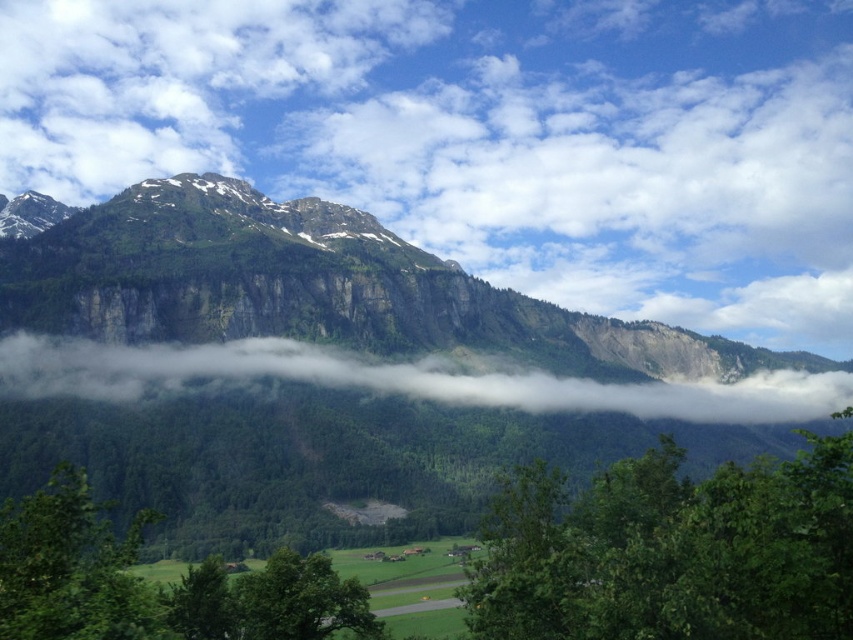
You are standing in the valley and want to take a photo of the green leafy tree at lower center and the green rocky mountain range at upper center. Which object will appear closer to you in the photo?

The green leafy tree at lower center will appear closer to you in the photo because it is positioned behind the green rocky mountain range at upper center, meaning the tree is farther away from the camera than the mountain range.

You are standing in the valley and looking towards the mountains. There is a point at coordinates [397,380] which marks a specific location in the scene. What is located at that point?

The point at coordinates [397,380] indicates the location of white fluffy fog at center.

You are an explorer trying to navigate through the valley. You see the green rocky mountain range at upper center and the white fluffy fog at center. Which object is positioned to the left of the other?

The green rocky mountain range at upper center is positioned to the left of the white fluffy fog at center.